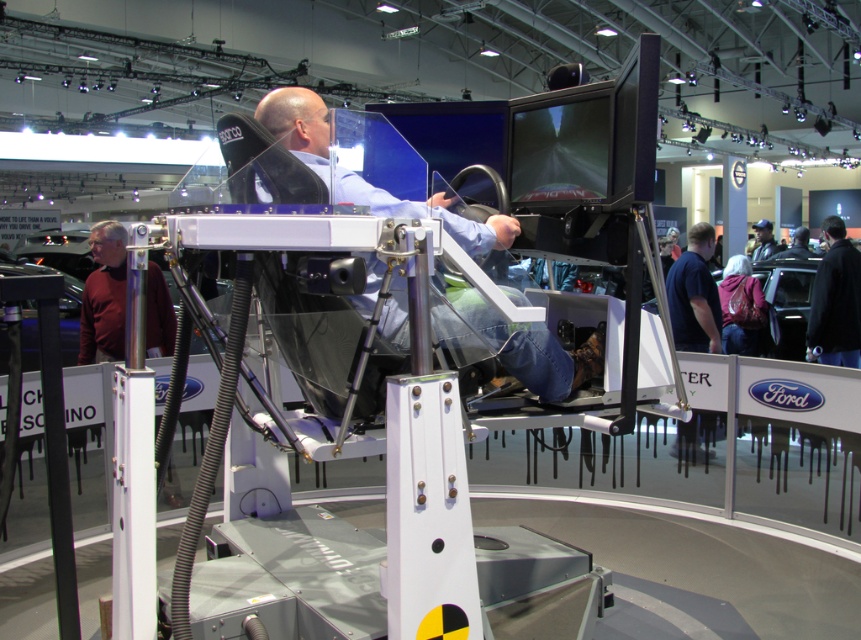
Question: Which object appears closest to the camera in this image?

Choices:
 (A) dark blue leather jacket at upper right
 (B) maroon sweater at left
 (C) black leather jacket at lower right

Answer: (B)

Question: Which point is farther from the camera taking this photo?

Choices:
 (A) (487, 336)
 (B) (767, 221)
 (C) (91, 339)
 (D) (840, 266)

Answer: (B)

Question: Which point appears farthest from the camera in this image?

Choices:
 (A) (354, 173)
 (B) (754, 256)
 (C) (156, 280)
 (D) (839, 250)

Answer: (B)

Question: Is maroon sweater at left above black leather jacket at lower right?

Choices:
 (A) no
 (B) yes

Answer: (A)

Question: In this image, where is matte black simulator at center located relative to dark blue leather jacket at upper right?

Choices:
 (A) below
 (B) above

Answer: (A)

Question: From the image, what is the correct spatial relationship of black leather jacket at lower right in relation to dark blue leather jacket at upper right?

Choices:
 (A) left
 (B) right

Answer: (A)